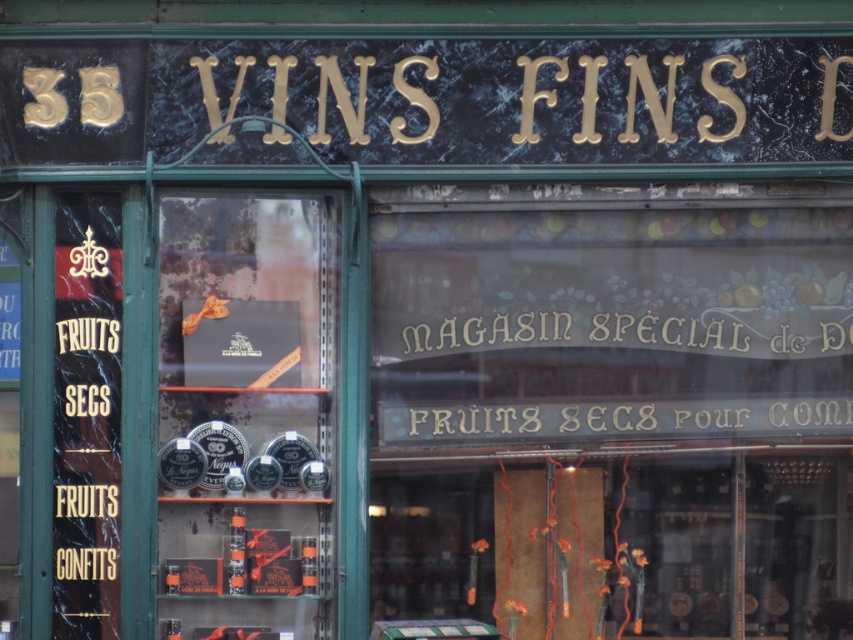
Question: Can you confirm if transparent glass signboard at center is thinner than white metallic sign at center?

Choices:
 (A) no
 (B) yes

Answer: (A)

Question: Can you confirm if transparent glass signboard at center is positioned to the right of white metallic sign at center?

Choices:
 (A) no
 (B) yes

Answer: (B)

Question: Which object is positioned closest to the matte black box at center?

Choices:
 (A) white metallic sign at center
 (B) transparent glass signboard at center

Answer: (A)

Question: Is transparent glass signboard at center closer to the viewer compared to white metallic sign at center?

Choices:
 (A) no
 (B) yes

Answer: (B)

Question: Among these objects, which one is nearest to the camera?

Choices:
 (A) matte black box at center
 (B) transparent glass signboard at center

Answer: (A)

Question: Estimate the real-world distances between objects in this image. Which object is closer to the matte black box at center?

Choices:
 (A) transparent glass signboard at center
 (B) white metallic sign at center

Answer: (B)